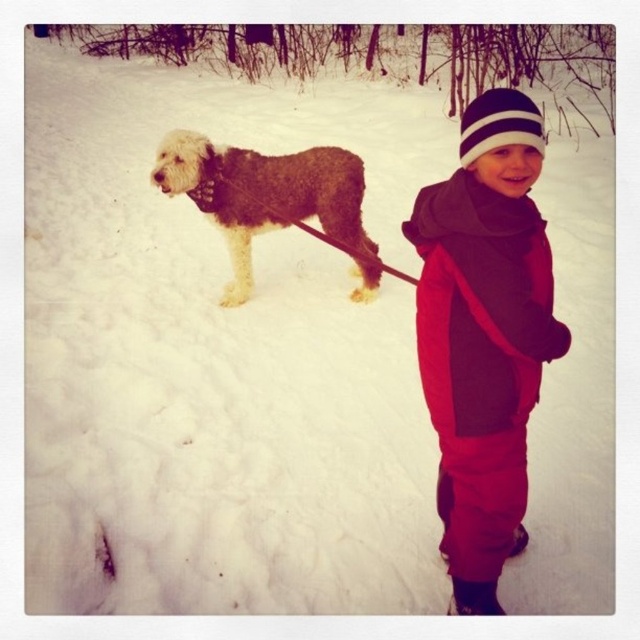
Is fuzzy brown dog at center bigger than white striped knit hat at upper center?

Indeed, fuzzy brown dog at center has a larger size compared to white striped knit hat at upper center.

Is fuzzy brown dog at center further to the viewer compared to white striped knit hat at upper center?

Yes.

Who is more forward, (237, 292) or (496, 129)?

Point (496, 129)

Identify the location of fuzzy brown dog at center. The image size is (640, 640). (262, 193).

Does red fleece jacket at center have a larger size compared to white striped knit hat at upper center?

Yes.

Who is more distant from viewer, (515,493) or (528,97)?

Positioned behind is point (528,97).

You are a GUI agent. You are given a task and a screenshot of the screen. Output one action in this format:
    pyautogui.click(x=<x>, y=<y>)
    Task: Click on the red fleece jacket at center
    The image size is (640, 640).
    Given the screenshot: What is the action you would take?
    pyautogui.click(x=484, y=336)

I want to click on red fleece jacket at center, so click(x=484, y=336).

Who is higher up, red fleece jacket at center or fuzzy brown dog at center?

fuzzy brown dog at center is higher up.

Which is more to the left, red fleece jacket at center or fuzzy brown dog at center?

fuzzy brown dog at center

Between point (522, 310) and point (234, 179), which one is positioned behind?

The point (234, 179) is behind.

Locate an element on the screen. The width and height of the screenshot is (640, 640). red fleece jacket at center is located at coordinates (484, 336).